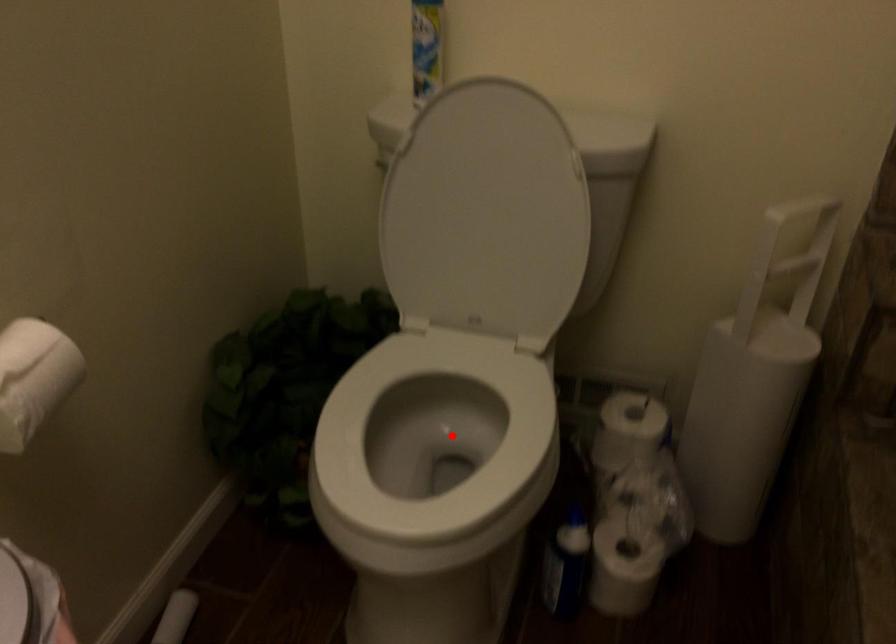
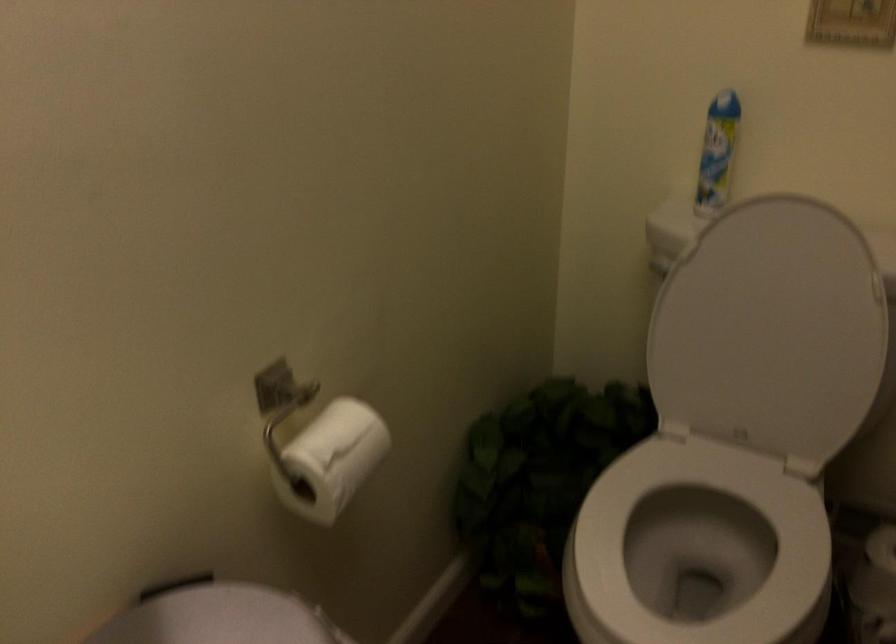
Find the pixel in the second image that matches the highlighted location in the first image.

(698, 547)